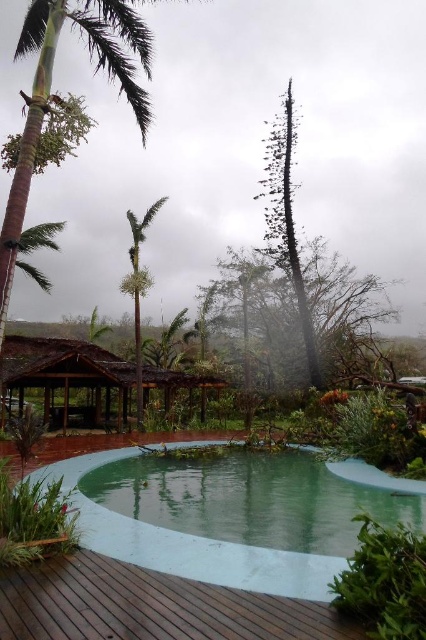
You are a visitor who wants to take shelter from the rain. You see the brown thatched hut at center and the green leafy palm tree at center. Which one would provide better protection from the rain?

The brown thatched hut at center is positioned under the green leafy palm tree at center, so the palm tree might block some rain, but the hut itself is more likely to offer better shelter.

You are a drone operator trying to capture aerial footage of the storm damage. Your drone is currently at the center of the pool. To avoid collision, you need to know the coordinates of the green leafy palm at upper left. What are its coordinates?

The green leafy palm at upper left is located at coordinates point (60,97).